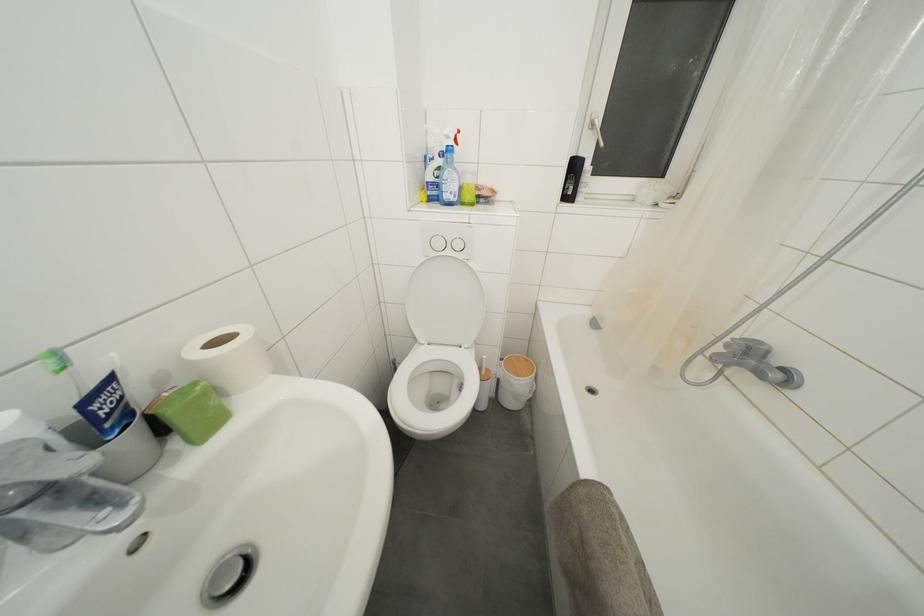
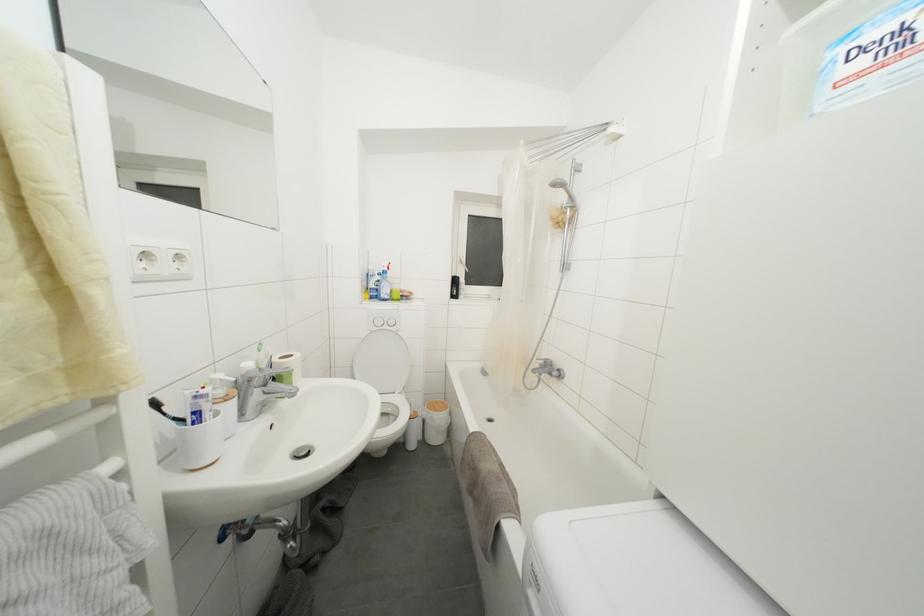
Based on the continuous images, in which direction is the camera rotating?

The camera's rotation is toward right-up.